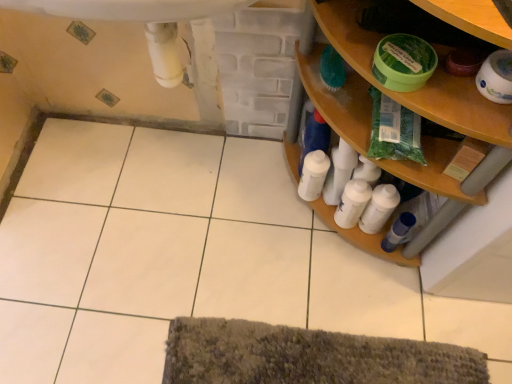
Locate an element on the screen. free location in front of white glossy bottles at center right, which is the 2th toiletry from right to left is located at coordinates (372, 288).